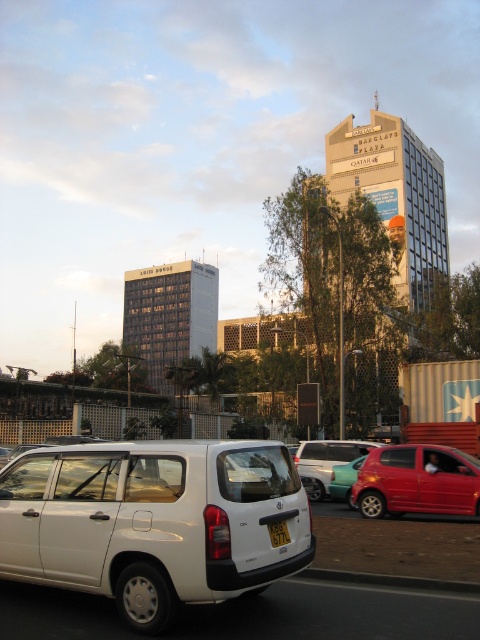
Question: Which point is farther to the camera?

Choices:
 (A) (313, 456)
 (B) (420, 474)
 (C) (34, 502)
 (D) (280, 545)

Answer: (A)

Question: Which of these objects is positioned farthest from the metallic silver car at center?

Choices:
 (A) teal glossy sedan at center
 (B) glossy red car at lower right
 (C) yellow matte license plate at center
 (D) white matte van at lower left

Answer: (D)

Question: Can you confirm if white matte van at lower left is positioned to the left of teal glossy sedan at center?

Choices:
 (A) no
 (B) yes

Answer: (B)

Question: Is white matte van at lower left to the left of teal glossy sedan at center from the viewer's perspective?

Choices:
 (A) yes
 (B) no

Answer: (A)

Question: Among these points, which one is farthest from the camera?

Choices:
 (A) (311, 484)
 (B) (287, 532)
 (C) (334, 490)

Answer: (A)

Question: Is white matte van at lower left smaller than metallic silver car at center?

Choices:
 (A) yes
 (B) no

Answer: (A)